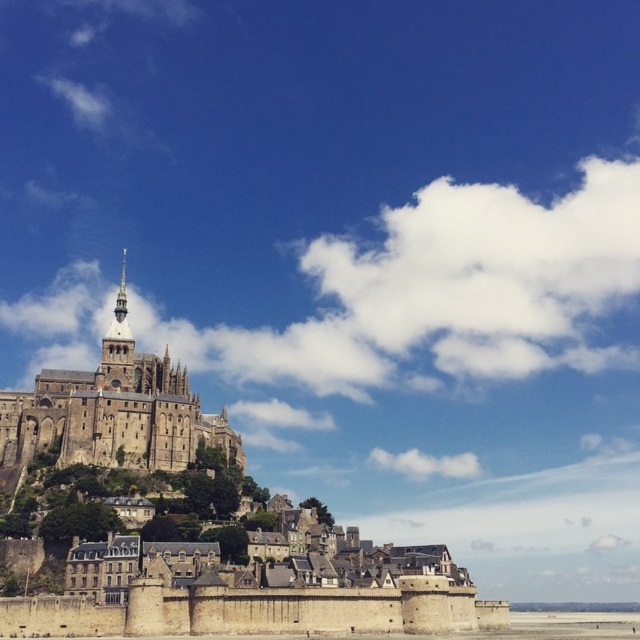
You are standing on the observation deck overlooking Mont Saint Michel and notice the golden stone tower at upper left and the clear blue water at lower center. Which of these two landmarks is positioned to the left when viewed from your current vantage point?

The golden stone tower at upper left is positioned to the left of the clear blue water at lower center.